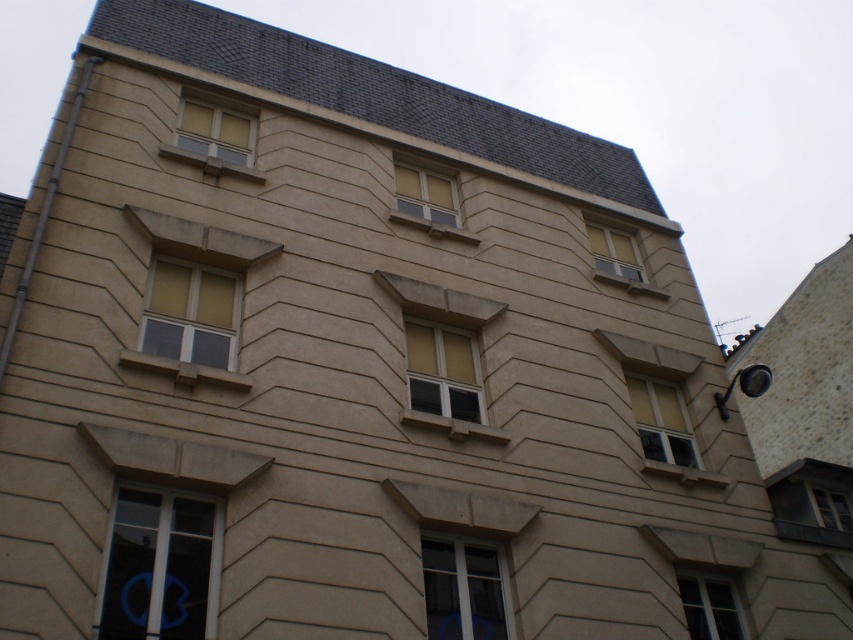
Question: Can you confirm if yellow matte window at center is thinner than matte glass window at lower right?

Choices:
 (A) no
 (B) yes

Answer: (A)

Question: Considering the real-world distances, which object is closest to the matte glass window at center-right?

Choices:
 (A) yellow matte window at center
 (B) transparent glass window at lower left
 (C) yellow matte window at upper left
 (D) yellow matte window at upper center

Answer: (A)

Question: Can you confirm if yellow matte window at upper center is positioned to the left of matte glass window at upper center?

Choices:
 (A) yes
 (B) no

Answer: (A)

Question: Which object appears closest to the camera in this image?

Choices:
 (A) matte glass window at upper center
 (B) matte glass window at center-right

Answer: (B)

Question: Which object is farther from the camera taking this photo?

Choices:
 (A) transparent glass window at lower left
 (B) yellow matte window at center
 (C) white plastic window at center
 (D) yellow matte window at upper left

Answer: (D)

Question: Is transparent glass window at lower left below clear glass window at center?

Choices:
 (A) yes
 (B) no

Answer: (B)